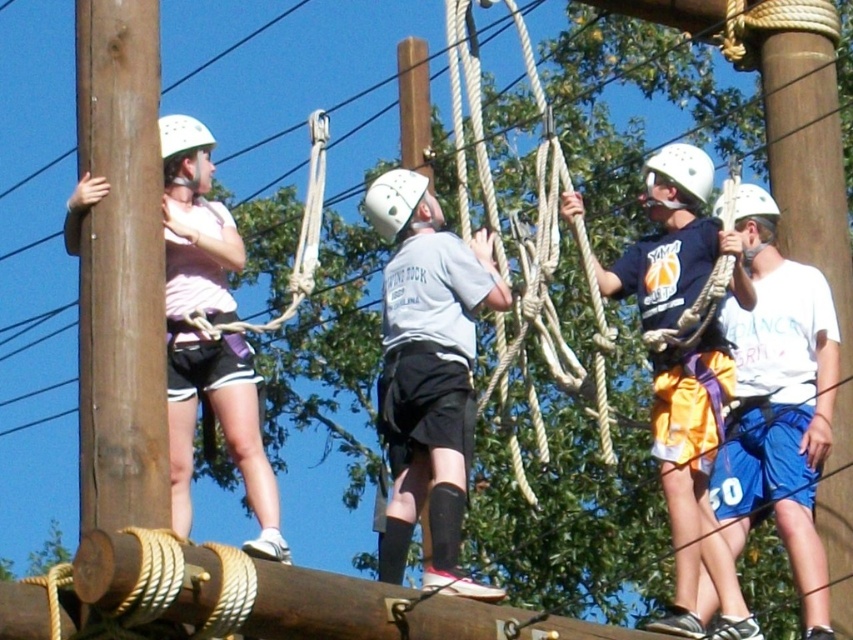
Question: Which of the following is the closest to the observer?

Choices:
 (A) white cotton shirt at center
 (B) brown rough wood at left

Answer: (B)

Question: Which point is farther to the camera?

Choices:
 (A) (767, 432)
 (B) (396, 186)

Answer: (A)

Question: Which point is farther to the camera?

Choices:
 (A) (428, 392)
 (B) (759, 200)
 (C) (798, 588)
 (D) (743, 602)

Answer: (D)

Question: Is matte pink shirt at left smaller than white matte helmet at upper center?

Choices:
 (A) yes
 (B) no

Answer: (B)

Question: Is matte blue shirt at center positioned before white matte helmet at upper left?

Choices:
 (A) yes
 (B) no

Answer: (B)

Question: Is white matte helmet at upper left to the right of white matte helmet at upper right from the viewer's perspective?

Choices:
 (A) yes
 (B) no

Answer: (B)